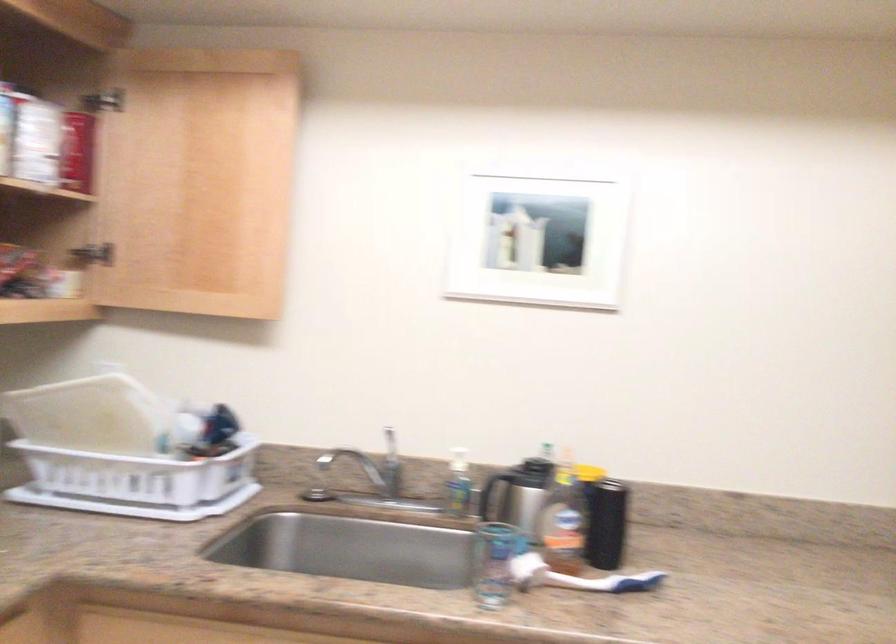
Locate an element on the screen. The width and height of the screenshot is (896, 644). soap dispenser pump is located at coordinates (458, 460).